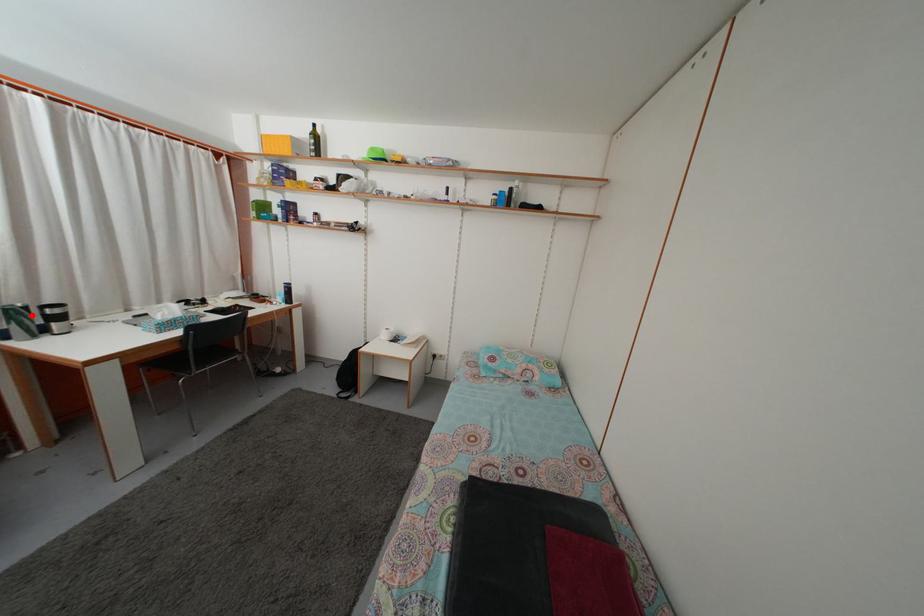
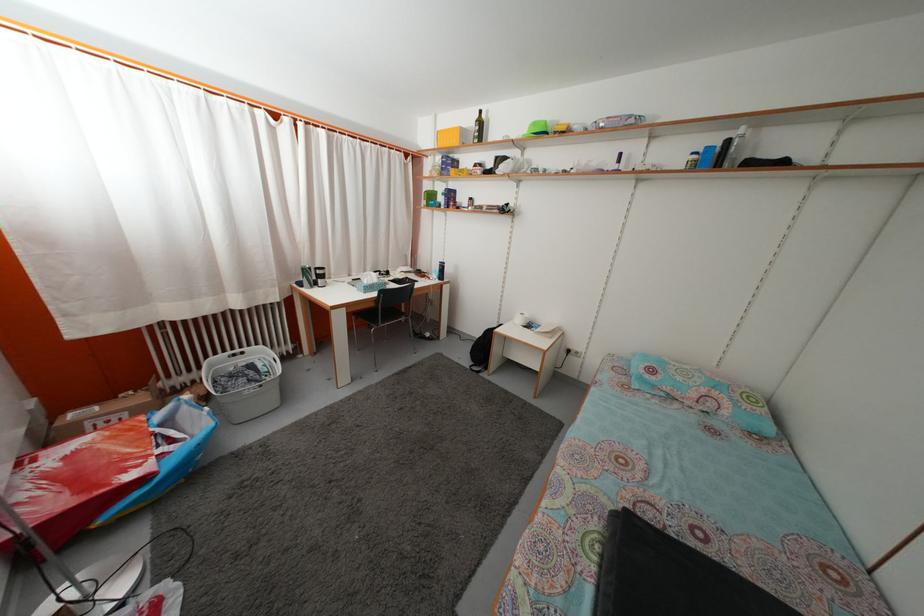
Where in the second image is the point corresponding to the highlighted location from the first image?

(315, 276)